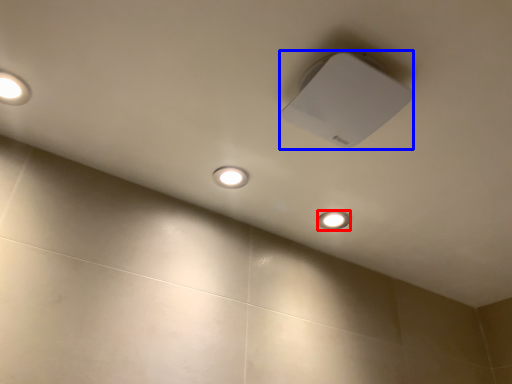
Question: Which object is further to the camera taking this photo, dot (highlighted by a red box) or lamp (highlighted by a blue box)?

Choices:
 (A) dot
 (B) lamp

Answer: (A)